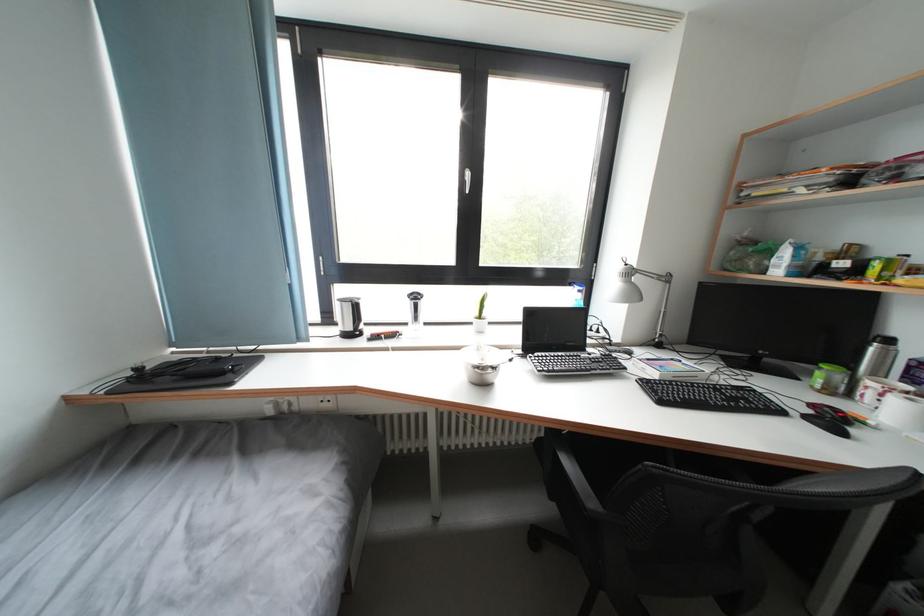
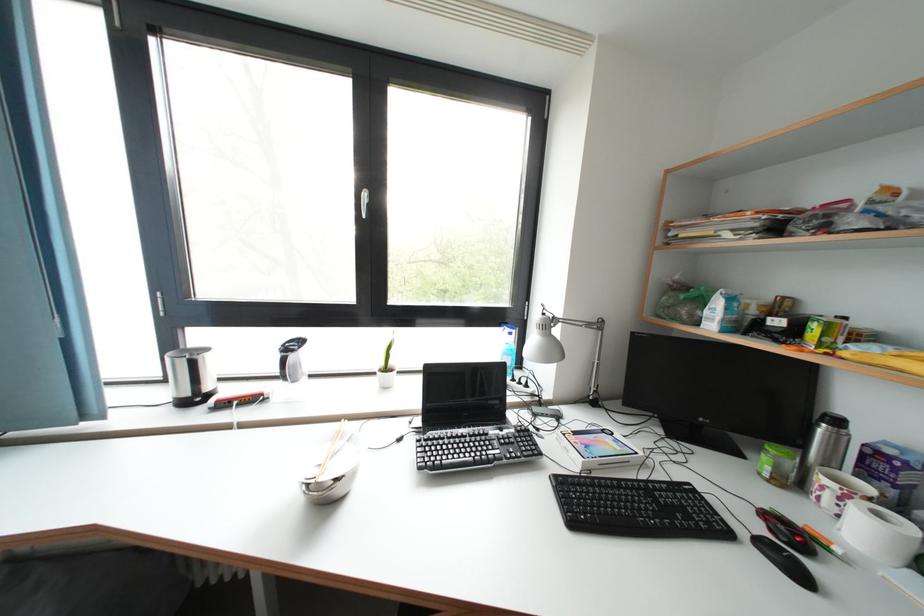
Question: The images are taken continuously from a first-person perspective. In which direction is your viewpoint rotating?

Choices:
 (A) Left
 (B) Right
 (C) Up
 (D) Down

Answer: (B)